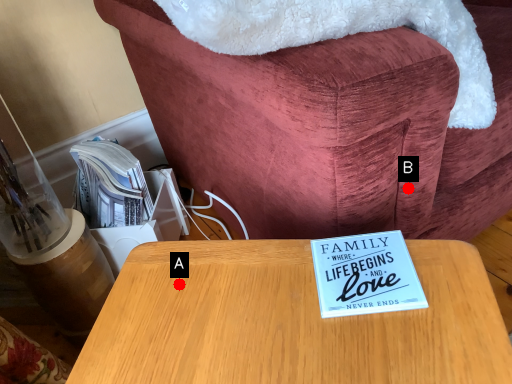
Question: Two points are circled on the image, labeled by A and B beside each circle. Which point is farther to the camera?

Choices:
 (A) A is further
 (B) B is further

Answer: (B)